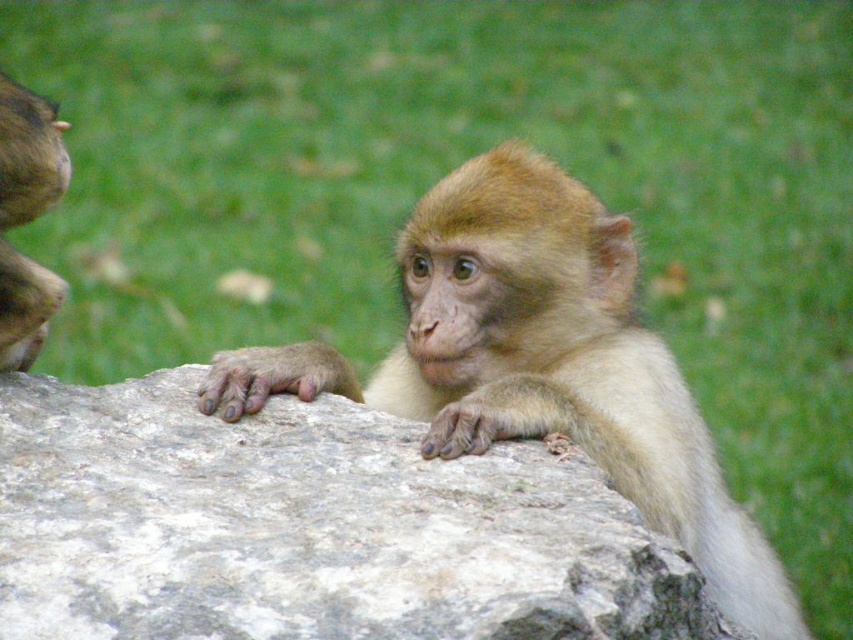
You are a photographer trying to capture the monkey on the gray rough rock at center. The camera you are using has a focus point at point (x=308, y=528). Will this focus point help you capture the monkey?

The gray rough rock at center is located at point (x=308, y=528), so yes, the focus point at point (x=308, y=528) will help you capture the monkey on the gray rough rock at center.

You are a photographer trying to capture the fuzzy brown monkey at center. To get a better shot, you want to know if the monkey is sitting on top of the gray rough rock at center. Based on the scene, can you confirm if the monkey is positioned above the rock?

The gray rough rock at center is located below the fuzzy brown monkey at center, so yes, the monkey is sitting on top of the gray rough rock at center.

You are a photographer trying to capture the golden fur monkey at left and the gray rough rock at center. Based on their positions, which object is closer to the camera?

The golden fur monkey at left is closer to the camera because the gray rough rock at center is below it, indicating depth where the monkey is positioned in front.